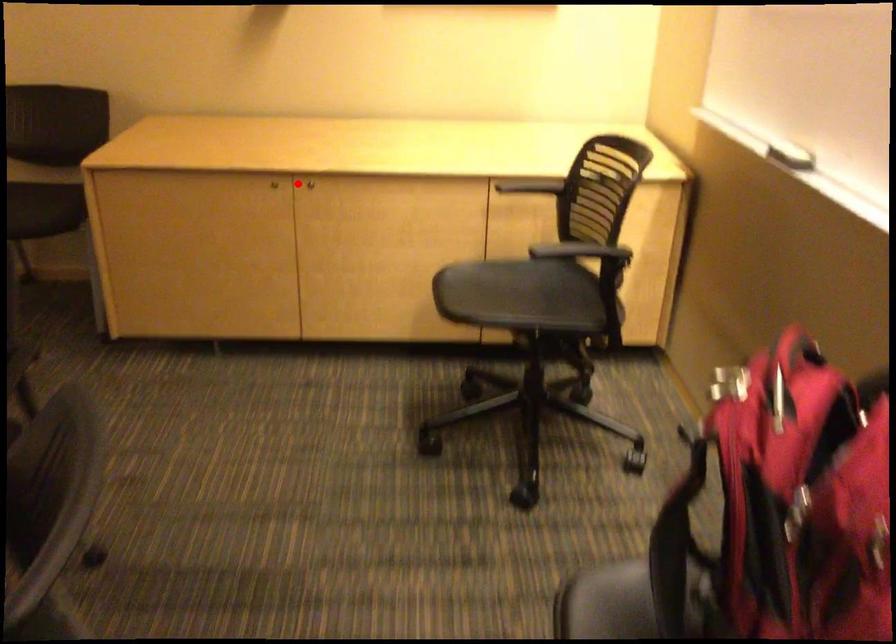
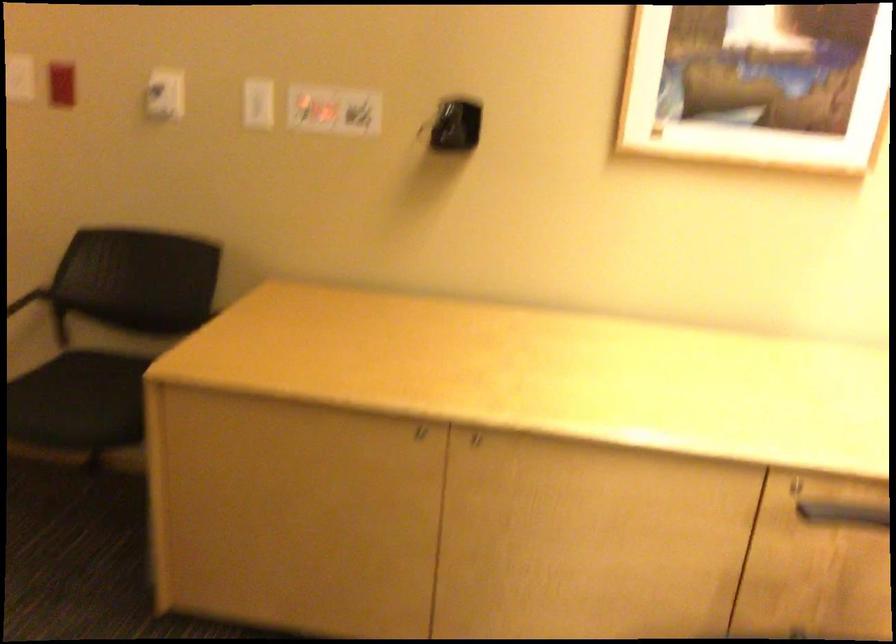
Question: I am providing you with two images of the same scene from different viewpoints. In image1, a red point is highlighted. Considering the same 3D point in image2, which of the following is correct?

Choices:
 (A) It is closer
 (B) It is farther

Answer: (A)